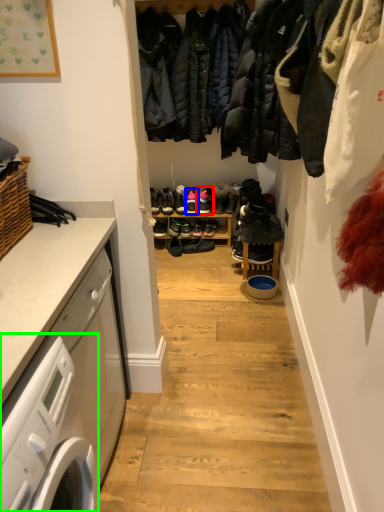
Question: Based on their relative distances, which object is farther from footwear (highlighted by a red box)? Choose from footwear (highlighted by a blue box) and washing machine (highlighted by a green box).

Choices:
 (A) footwear
 (B) washing machine

Answer: (B)